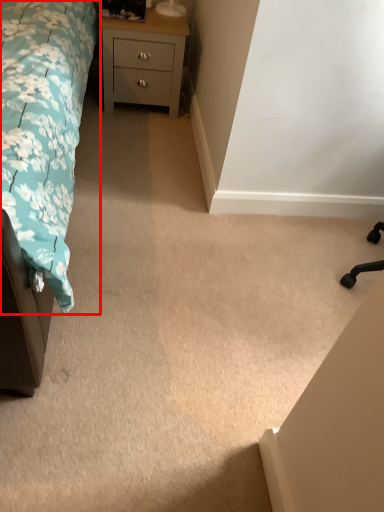
Question: From the image's perspective, considering the relative positions of bed (annotated by the red box) and chest of drawers in the image provided, where is bed (annotated by the red box) located with respect to the staircase?

Choices:
 (A) below
 (B) above

Answer: (A)